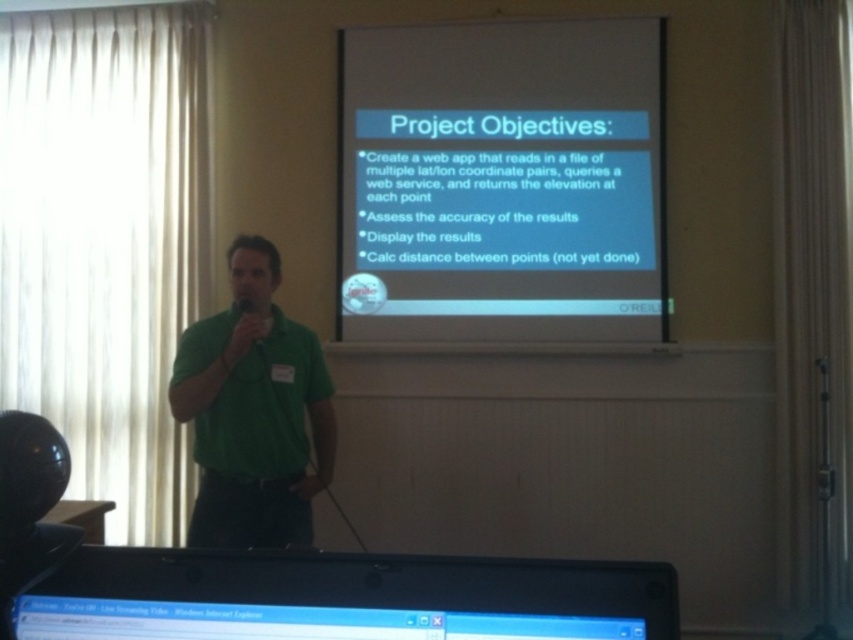
Question: Is white matte projector screen at upper center further to the viewer compared to black plastic monitor at lower center?

Choices:
 (A) yes
 (B) no

Answer: (A)

Question: Estimate the real-world distances between objects in this image. Which object is closer to the white matte projector screen at upper center?

Choices:
 (A) black plastic monitor at lower center
 (B) green matte shirt at center

Answer: (B)

Question: Which of the following is the farthest from the observer?

Choices:
 (A) (70, 637)
 (B) (601, 193)

Answer: (B)

Question: Is black plastic monitor at lower center wider than green matte shirt at center?

Choices:
 (A) yes
 (B) no

Answer: (A)

Question: Among these objects, which one is farthest from the camera?

Choices:
 (A) black plastic monitor at lower center
 (B) green matte shirt at center

Answer: (B)

Question: Does white matte projector screen at upper center have a lesser width compared to black plastic monitor at lower center?

Choices:
 (A) yes
 (B) no

Answer: (B)